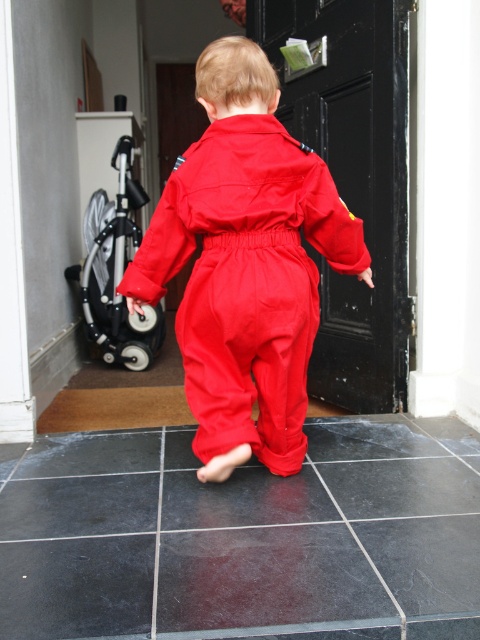
Question: Does black wooden door at center appear over silver metallic stroller at left?

Choices:
 (A) yes
 (B) no

Answer: (A)

Question: Does black wooden door at center appear on the left side of silver metallic stroller at left?

Choices:
 (A) yes
 (B) no

Answer: (B)

Question: In this image, where is black wooden door at center located relative to silver metallic stroller at left?

Choices:
 (A) right
 (B) left

Answer: (A)

Question: Which point is farther from the camera taking this photo?

Choices:
 (A) (110, 204)
 (B) (408, 301)

Answer: (A)

Question: Considering the real-world distances, which object is farthest from the matte red jumpsuit at center?

Choices:
 (A) black wooden door at center
 (B) silver metallic stroller at left

Answer: (B)

Question: Which object is positioned closest to the black wooden door at center?

Choices:
 (A) matte red jumpsuit at center
 (B) silver metallic stroller at left

Answer: (A)